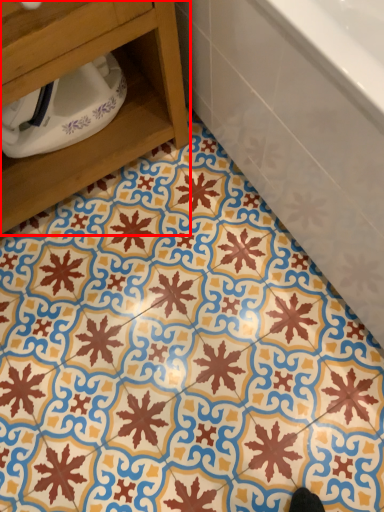
Question: Where is furniture (annotated by the red box) located in relation to bathtub in the image?

Choices:
 (A) left
 (B) right

Answer: (A)